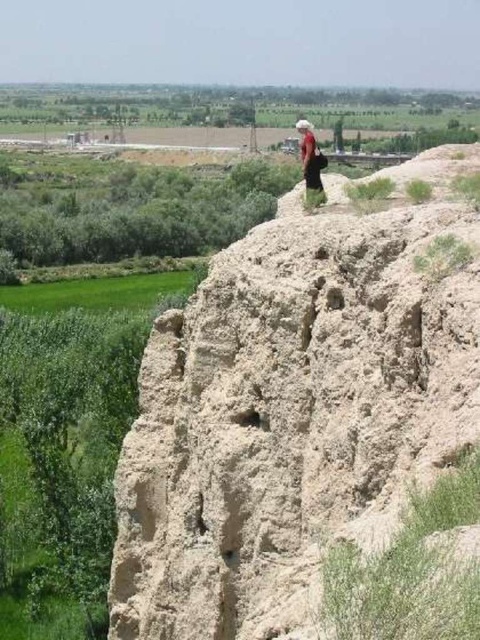
Which is more to the right, light beige rough rock at center or matte red dress at center?

From the viewer's perspective, matte red dress at center appears more on the right side.

Is point (276, 499) positioned before point (312, 173)?

Yes, it is.

Identify the location of light beige rough rock at center. This screenshot has height=640, width=480. (296, 410).